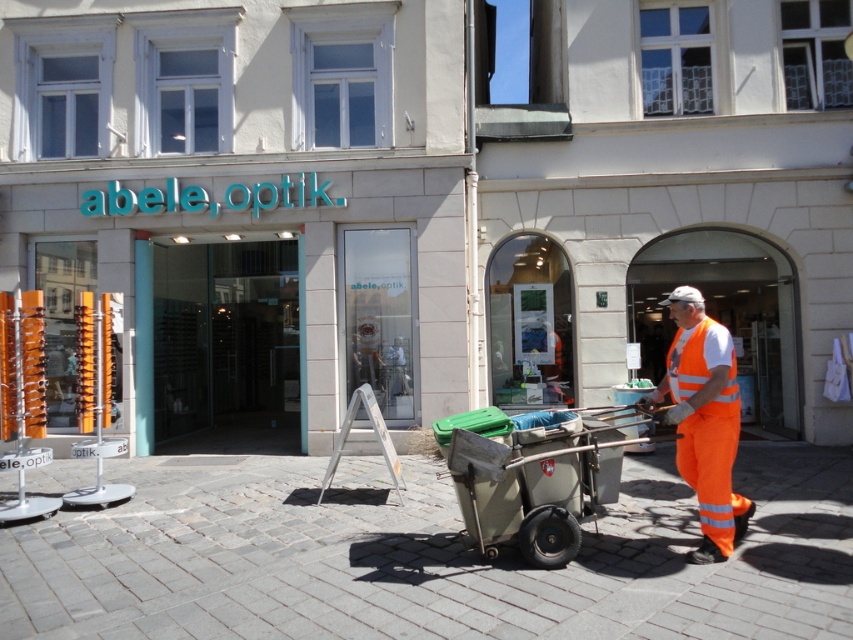
Question: Is metallic gray cart at center smaller than high visibility orange jumpsuit at center?

Choices:
 (A) no
 (B) yes

Answer: (B)

Question: Which point is farther from the camera taking this photo?

Choices:
 (A) (514, 428)
 (B) (697, 476)

Answer: (A)

Question: Can you confirm if brick paved at center is positioned below high visibility orange jumpsuit at center?

Choices:
 (A) yes
 (B) no

Answer: (A)

Question: Which of the following is the closest to the observer?

Choices:
 (A) (728, 387)
 (B) (368, 596)
 (C) (727, 353)
 (D) (527, 484)

Answer: (B)

Question: Observing the image, what is the correct spatial positioning of brick paved at center in reference to metallic gray cart at center?

Choices:
 (A) left
 (B) right

Answer: (A)

Question: Which point appears farthest from the camera in this image?

Choices:
 (A) (723, 342)
 (B) (733, 378)
 (C) (293, 465)

Answer: (C)